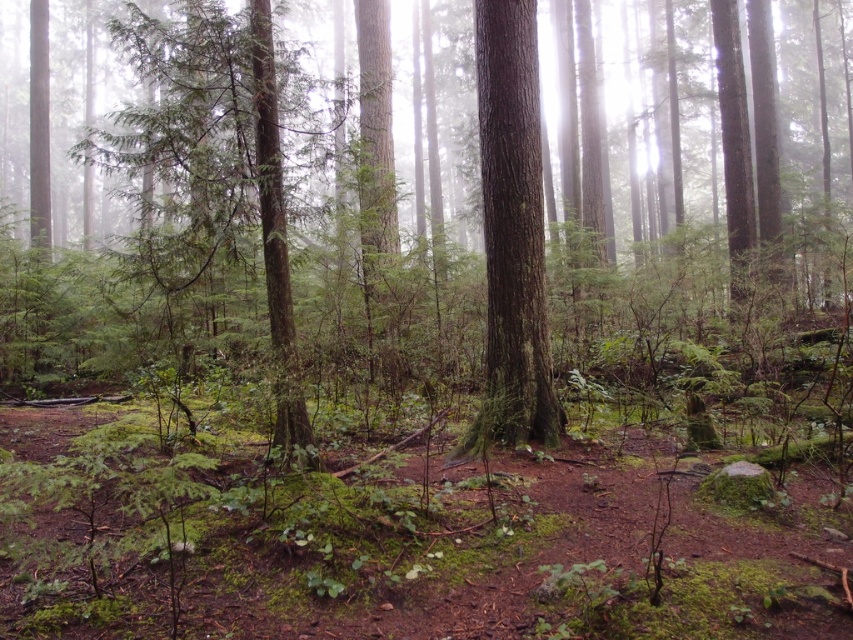
What do you see at coordinates (550, 177) in the screenshot? This screenshot has height=640, width=853. I see `green matte tree at center` at bounding box center [550, 177].

Does green matte tree at center have a lesser height compared to smooth brown tree trunk at center?

No, green matte tree at center is not shorter than smooth brown tree trunk at center.

Who is more distant from viewer, (314, 216) or (496, 324)?

Positioned behind is point (496, 324).

Where is `green matte tree at center`? The height and width of the screenshot is (640, 853). green matte tree at center is located at coordinates (550, 177).